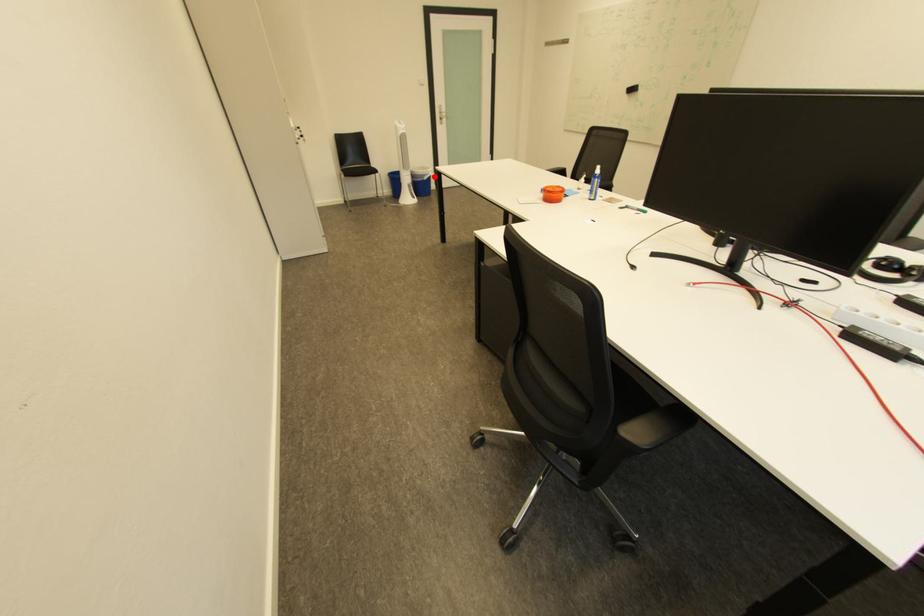
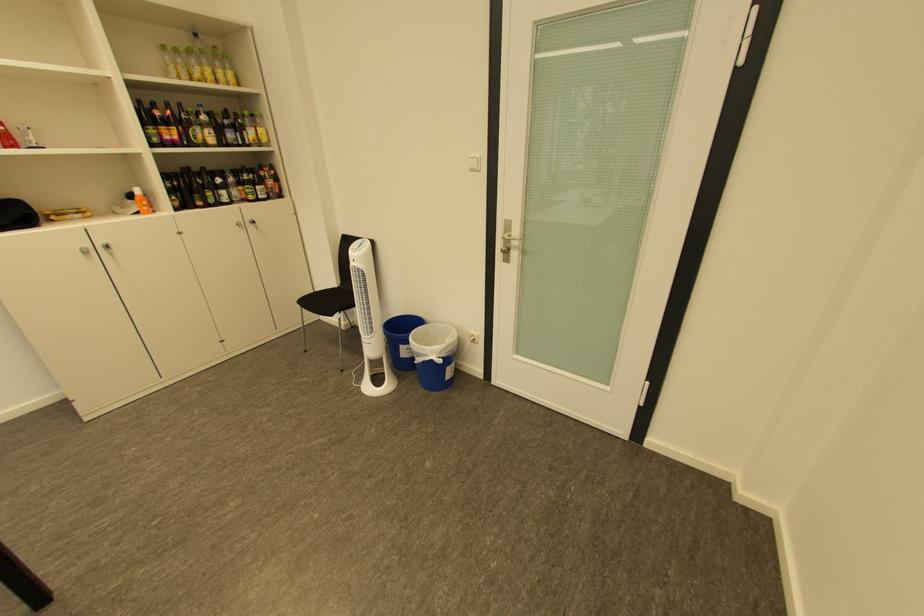
In the second image, find the point that corresponds to the highlighted location in the first image.

(429, 355)